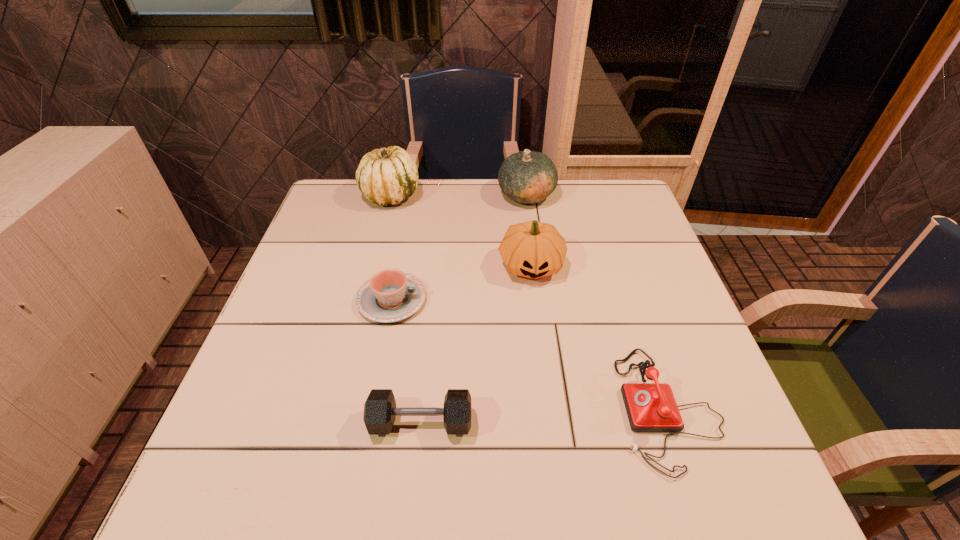
In the image, there is a desktop. Where is `vacant space at the far left corner`? This screenshot has width=960, height=540. vacant space at the far left corner is located at coordinates (358, 193).

The width and height of the screenshot is (960, 540). I want to click on free region at the far right corner, so click(x=606, y=222).

Where is `free space between the rightmost object and the leftmost gourd`? The height and width of the screenshot is (540, 960). free space between the rightmost object and the leftmost gourd is located at coordinates (529, 301).

Image resolution: width=960 pixels, height=540 pixels. What are the coordinates of `free space between the telephone and the nearest gourd` in the screenshot? It's located at (600, 337).

I want to click on empty space that is in between the dumbbell and the chinaware, so click(x=406, y=361).

Locate an element on the screen. Image resolution: width=960 pixels, height=540 pixels. free space between the dumbbell and the shortest object is located at coordinates (x=406, y=361).

What are the coordinates of `empty location between the dumbbell and the shortest object` in the screenshot? It's located at (406, 361).

Locate an element on the screen. Image resolution: width=960 pixels, height=540 pixels. object that stands as the third closest to the nearest gourd is located at coordinates (651, 407).

Where is `the closest object to the rightmost object`? This screenshot has height=540, width=960. the closest object to the rightmost object is located at coordinates (532, 249).

Identify which gourd is the second closest to the dumbbell. Please provide its 2D coordinates. Your answer should be formatted as a tuple, i.e. [(x, y)], where the tuple contains the x and y coordinates of a point satisfying the conditions above.

[(387, 176)]